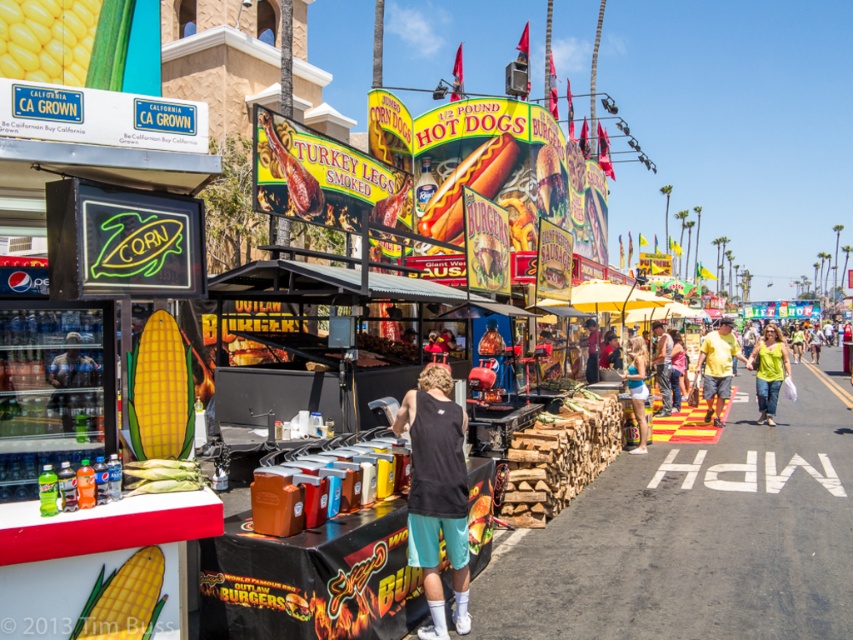
Question: Is yellow matte corn at lower left smaller than smoked turkey leg at center?

Choices:
 (A) no
 (B) yes

Answer: (B)

Question: Which point appears closest to the camera in this image?

Choices:
 (A) (450, 232)
 (B) (387, 224)
 (C) (413, 442)

Answer: (C)

Question: Is yellow matte corn at upper left to the left of matte black tank top at center from the viewer's perspective?

Choices:
 (A) yes
 (B) no

Answer: (A)

Question: Which object appears closest to the camera in this image?

Choices:
 (A) yellow matte corn at lower left
 (B) matte black tank top at center
 (C) white cotton tank top at center
 (D) shiny chrome hot dog at center

Answer: (A)

Question: Is yellow matte corn at upper left above matte black tank top at center?

Choices:
 (A) no
 (B) yes

Answer: (B)

Question: Based on their relative distances, which object is farther from the shiny chrome hot dog at center?

Choices:
 (A) yellow-green shirt at center
 (B) smoked turkey leg at center

Answer: (B)